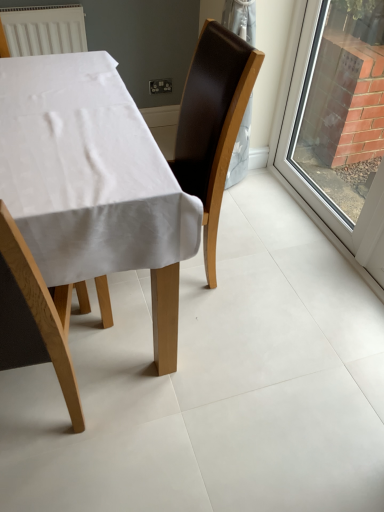
The height and width of the screenshot is (512, 384). Find the location of `free space to the back side of wooden chair at lower left, which is counted as the second chair, starting from the back`. free space to the back side of wooden chair at lower left, which is counted as the second chair, starting from the back is located at coordinates (89, 352).